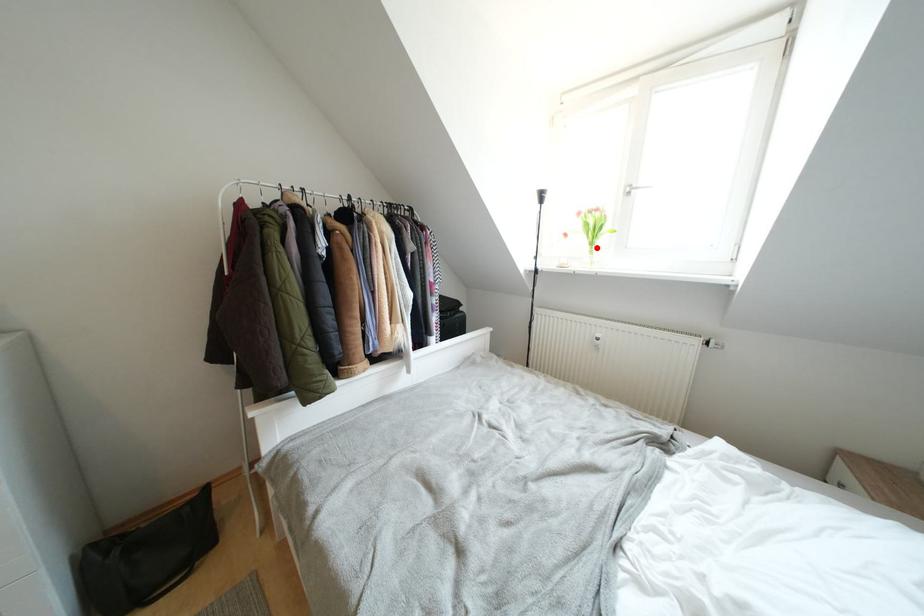
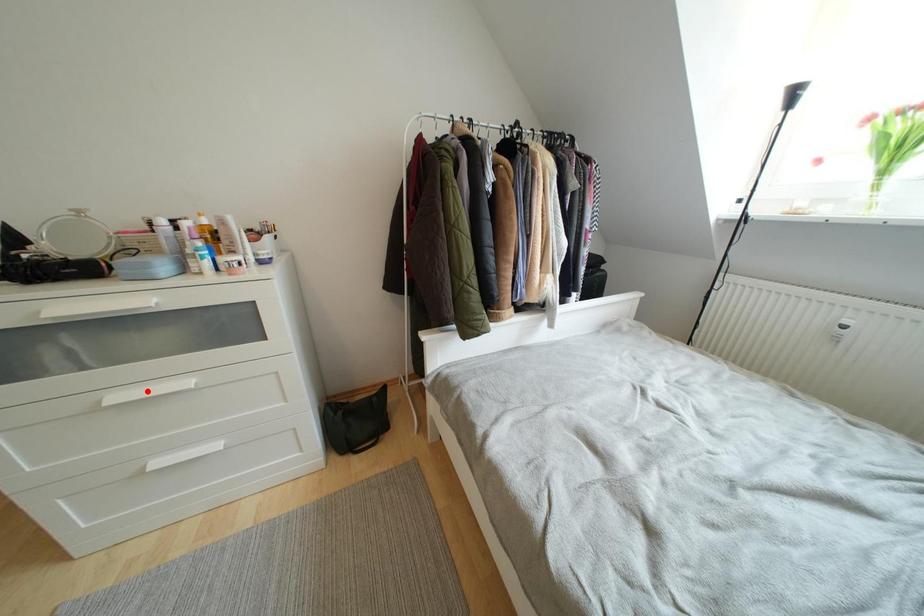
I am providing you with two images of the same scene from different viewpoints. A red point is marked on the first image and another point is marked on the second image. Is the marked point in image1 the same physical position as the marked point in image2?

No